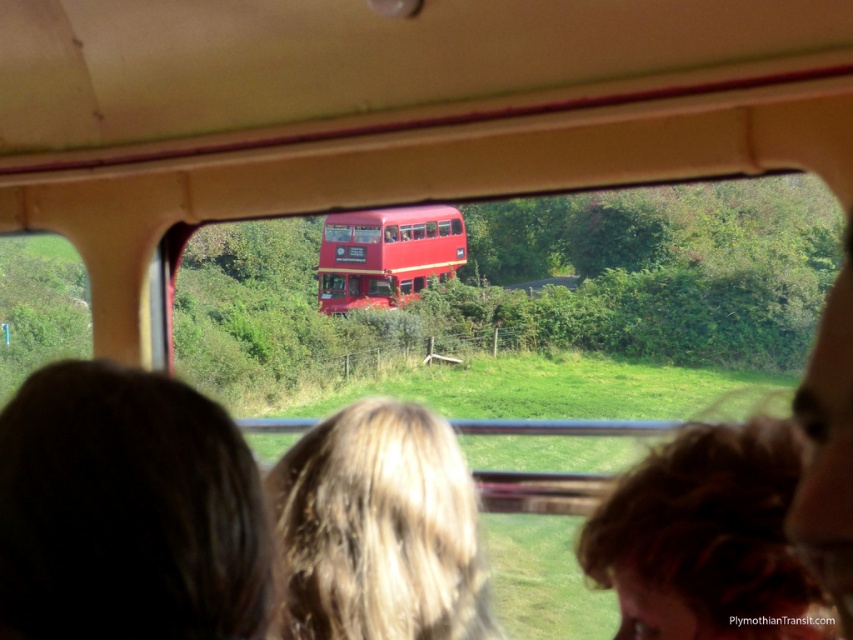
Does blonde hair at center have a lesser height compared to shiny red bus at center?

Correct, blonde hair at center is not as tall as shiny red bus at center.

Find the location of a particular element. The image size is (853, 640). blonde hair at center is located at coordinates (379, 529).

Image resolution: width=853 pixels, height=640 pixels. In order to click on blonde hair at center in this screenshot , I will do pyautogui.click(x=379, y=529).

Does blonde hair at center have a smaller size compared to blonde hair at lower center?

No.

Measure the distance between blonde hair at center and blonde hair at lower center.

blonde hair at center and blonde hair at lower center are 16.40 inches apart.

Which is behind, point (286, 454) or point (703, 445)?

The point (286, 454) is more distant.

Where is `blonde hair at center`? blonde hair at center is located at coordinates (379, 529).

Is dark brown hair at lower left positioned before blonde hair at lower center?

Yes.

Which is behind, point (3, 531) or point (712, 481)?

Point (712, 481)

Where is `dark brown hair at lower left`? The height and width of the screenshot is (640, 853). dark brown hair at lower left is located at coordinates (126, 509).